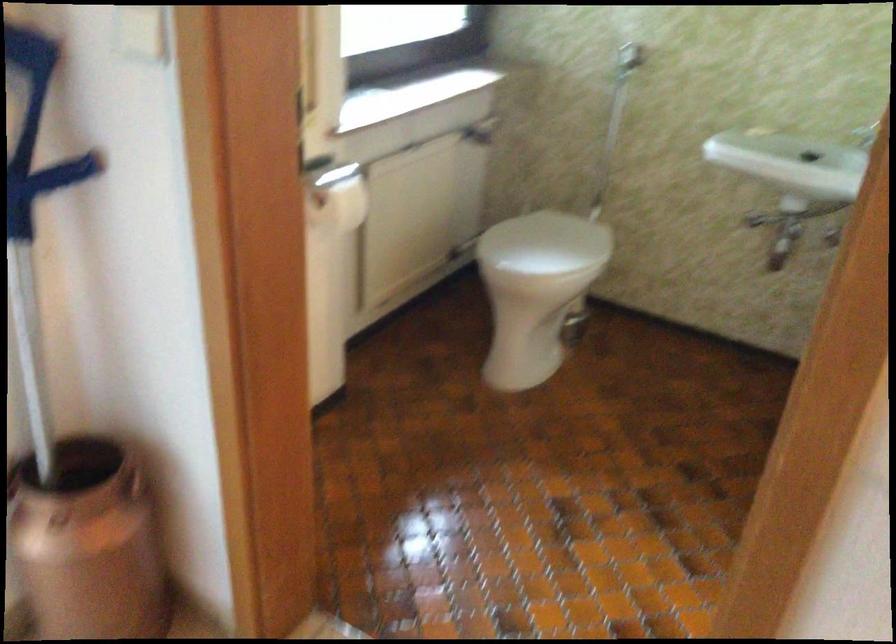
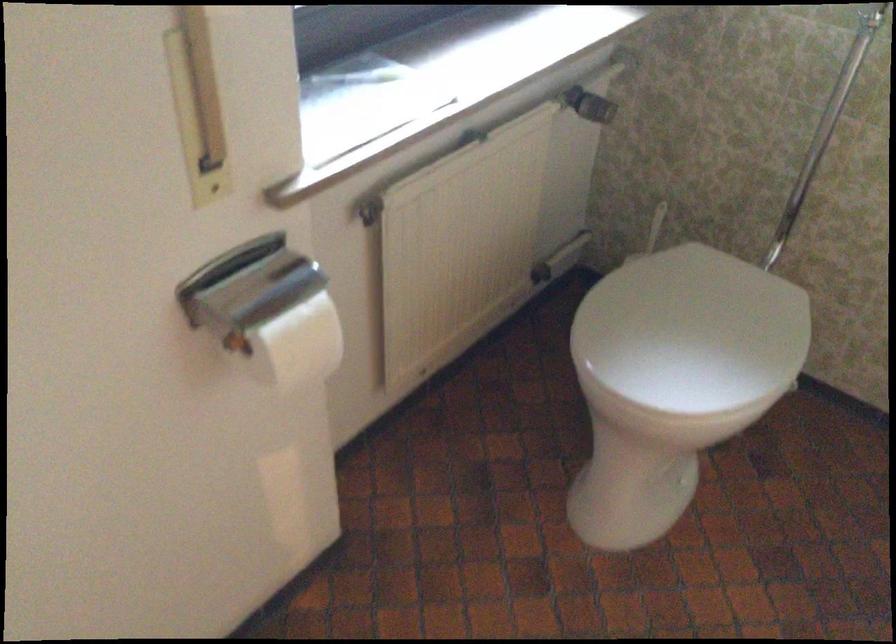
Where in the second image is the point corresponding to pixel 306 185 from the first image?

(247, 285)